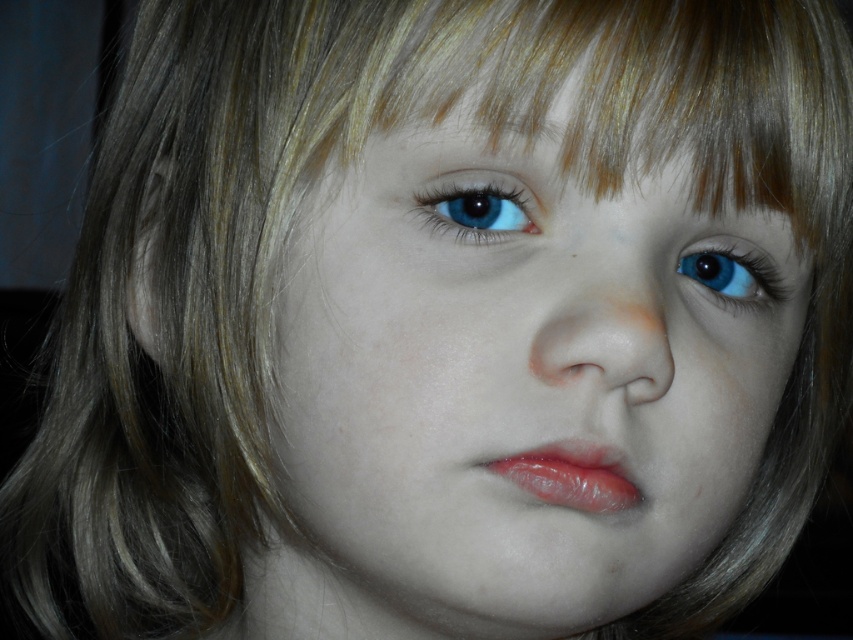
Question: Is smooth skin face at center closer to the viewer compared to smooth skin nose at center?

Choices:
 (A) no
 (B) yes

Answer: (A)

Question: Among these objects, which one is farthest from the camera?

Choices:
 (A) smooth skin face at center
 (B) glossy lips at center
 (C) blue glossy eye at upper center

Answer: (C)

Question: Which object is closer to the camera taking this photo?

Choices:
 (A) smooth skin nose at center
 (B) glossy lips at center
 (C) blue glossy eye at upper center

Answer: (A)

Question: Can you confirm if smooth skin face at center is bigger than blue glossy eye at center?

Choices:
 (A) yes
 (B) no

Answer: (A)

Question: Which of the following is the farthest from the observer?

Choices:
 (A) blue glossy eye at center
 (B) smooth skin face at center

Answer: (A)

Question: Does shiny blonde hair at upper center have a larger size compared to blue glossy eye at center?

Choices:
 (A) no
 (B) yes

Answer: (B)